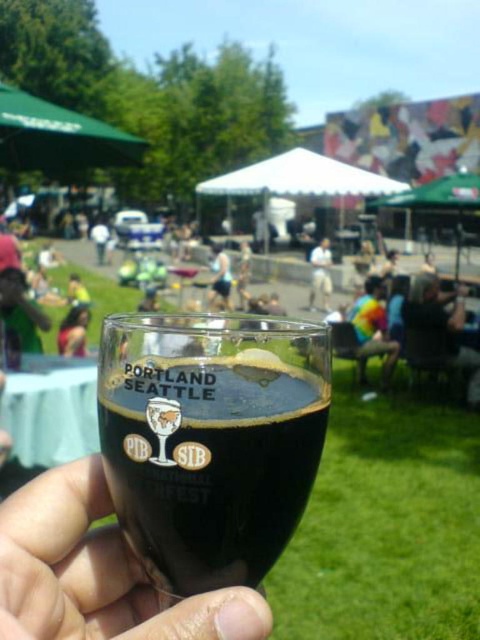
You are at a beer festival and holding a transparent glass at center and a white cotton shirt at center. Which item is closer to your hand?

The transparent glass at center is closer to your hand because it is positioned under the white cotton shirt at center, meaning it is in front of the shirt.

You are at a beer festival and holding a transparent glass at center and a white cotton shirt at center. If you want to place both items on a table, which one will occupy more horizontal space?

The transparent glass at center has a larger width than the white cotton shirt at center, so it will occupy more horizontal space.